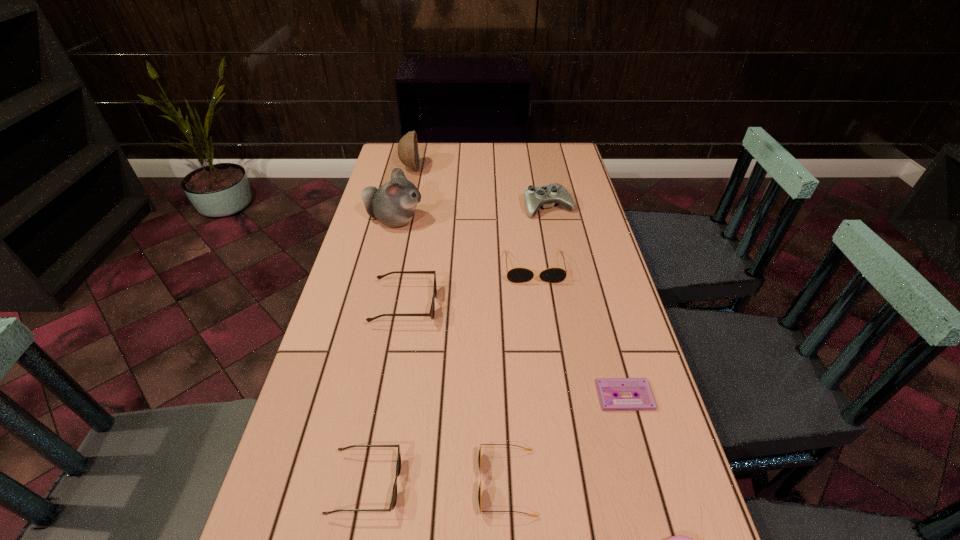
Locate an element on the screen. The width and height of the screenshot is (960, 540). free area in between the sixth farthest object and the seventh shortest object is located at coordinates (587, 301).

Locate an element on the screen. This screenshot has height=540, width=960. free space between the farther brown sunglasses and the nearer black sunglasses is located at coordinates (456, 394).

The width and height of the screenshot is (960, 540). What are the coordinates of `free space between the farther black sunglasses and the smaller black sunglasses` in the screenshot? It's located at (520, 375).

You are a GUI agent. You are given a task and a screenshot of the screen. Output one action in this format:
    pyautogui.click(x=<x>, y=<y>)
    Task: Click on the free spot between the control and the shortest object
    This screenshot has height=540, width=960.
    Given the screenshot: What is the action you would take?
    pyautogui.click(x=587, y=301)

Where is `free spot between the smaller brown sunglasses and the bigger brown sunglasses`? free spot between the smaller brown sunglasses and the bigger brown sunglasses is located at coordinates (385, 395).

At what (x,y) coordinates should I click in order to perform the action: click on free space between the nearer black sunglasses and the shortest object. Please return your answer as a coordinate pair (x, y). The image size is (960, 540). Looking at the image, I should click on (565, 440).

Select which object is the closest to the third tallest object. Please provide its 2D coordinates. Your answer should be formatted as a tuple, i.e. [(x, y)], where the tuple contains the x and y coordinates of a point satisfying the conditions above.

[(516, 275)]

The width and height of the screenshot is (960, 540). What are the coordinates of `the second closest object relative to the smaller black sunglasses` in the screenshot? It's located at (607, 388).

Select which sunglasses appears as the fourth closest to the white hamster. Please provide its 2D coordinates. Your answer should be formatted as a tuple, i.e. [(x, y)], where the tuple contains the x and y coordinates of a point satisfying the conditions above.

[(479, 456)]

This screenshot has height=540, width=960. Find the location of `the closest sunglasses to the farther brown sunglasses`. the closest sunglasses to the farther brown sunglasses is located at coordinates (516, 275).